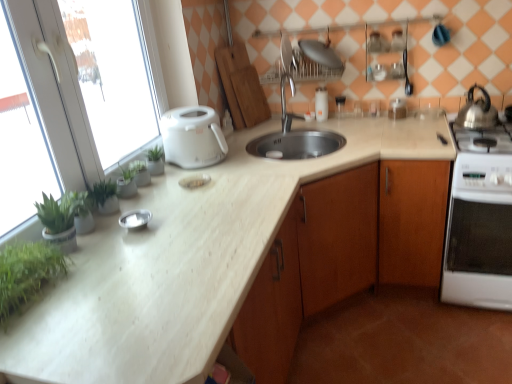
You are a GUI agent. You are given a task and a screenshot of the screen. Output one action in this format:
    pyautogui.click(x=<x>, y=<y>)
    Task: Click on the vacant area located to the right-hand side of silver metallic bowl at center, which is the 1th appliance from front to back
    The width and height of the screenshot is (512, 384).
    Given the screenshot: What is the action you would take?
    pyautogui.click(x=182, y=217)